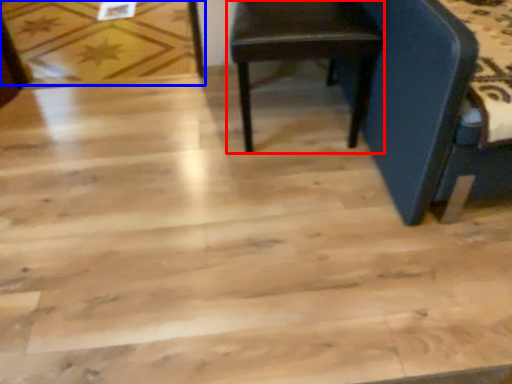
Question: Which object is closer to the camera taking this photo, chair (highlighted by a red box) or plywood (highlighted by a blue box)?

Choices:
 (A) chair
 (B) plywood

Answer: (A)